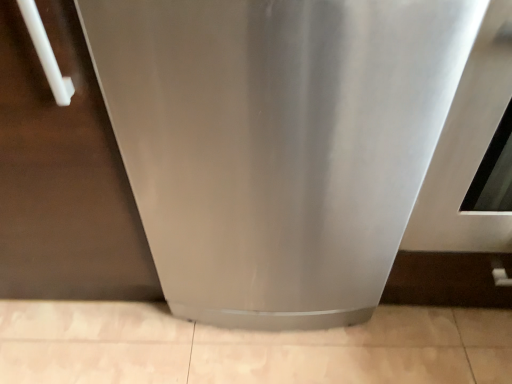
Question: Is satin silver refrigerator at lower left shorter than stainless steel refrigerator at center?

Choices:
 (A) yes
 (B) no

Answer: (A)

Question: Could you tell me if satin silver refrigerator at lower left is facing stainless steel refrigerator at center?

Choices:
 (A) yes
 (B) no

Answer: (B)

Question: Considering the relative sizes of satin silver refrigerator at lower left and stainless steel refrigerator at center in the image provided, is satin silver refrigerator at lower left smaller than stainless steel refrigerator at center?

Choices:
 (A) yes
 (B) no

Answer: (B)

Question: Considering the relative sizes of satin silver refrigerator at lower left and stainless steel refrigerator at center in the image provided, is satin silver refrigerator at lower left wider than stainless steel refrigerator at center?

Choices:
 (A) no
 (B) yes

Answer: (A)

Question: Does satin silver refrigerator at lower left have a lesser width compared to stainless steel refrigerator at center?

Choices:
 (A) no
 (B) yes

Answer: (B)

Question: Is the position of satin silver refrigerator at lower left more distant than that of stainless steel refrigerator at center?

Choices:
 (A) yes
 (B) no

Answer: (A)

Question: Does stainless steel refrigerator at center have a larger size compared to satin silver refrigerator at lower left?

Choices:
 (A) yes
 (B) no

Answer: (B)

Question: Is the depth of stainless steel refrigerator at center less than that of satin silver refrigerator at lower left?

Choices:
 (A) yes
 (B) no

Answer: (A)

Question: Does stainless steel refrigerator at center turn towards satin silver refrigerator at lower left?

Choices:
 (A) yes
 (B) no

Answer: (B)

Question: From a real-world perspective, does stainless steel refrigerator at center stand above satin silver refrigerator at lower left?

Choices:
 (A) yes
 (B) no

Answer: (A)

Question: Considering the relative positions of stainless steel refrigerator at center and satin silver refrigerator at lower left in the image provided, is stainless steel refrigerator at center to the right of satin silver refrigerator at lower left from the viewer's perspective?

Choices:
 (A) yes
 (B) no

Answer: (A)

Question: Is stainless steel refrigerator at center at the left side of satin silver refrigerator at lower left?

Choices:
 (A) yes
 (B) no

Answer: (B)

Question: From a real-world perspective, is satin silver refrigerator at lower left positioned above or below stainless steel refrigerator at center?

Choices:
 (A) below
 (B) above

Answer: (A)